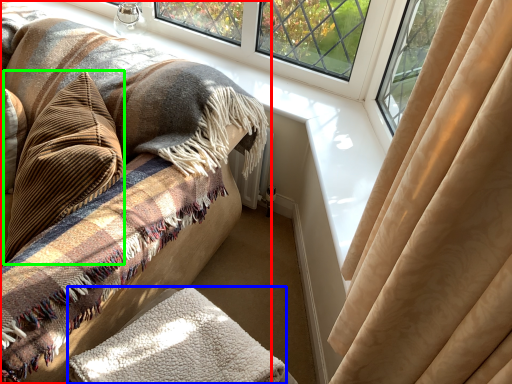
Question: Which is nearer to the furniture (highlighted by a red box)? blanket (highlighted by a blue box) or throw pillow (highlighted by a green box).

Choices:
 (A) blanket
 (B) throw pillow

Answer: (B)